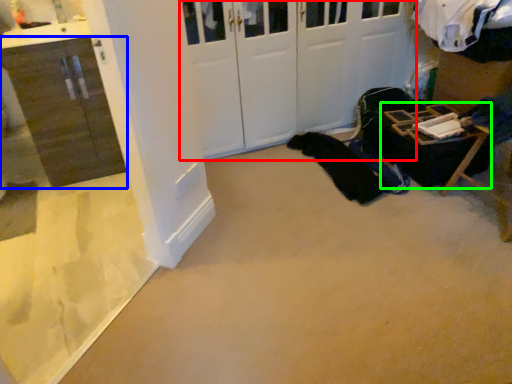
Question: Estimate the real-world distances between objects in this image. Which object is closer to door (highlighted by a red box), cabinetry (highlighted by a blue box) or furniture (highlighted by a green box)?

Choices:
 (A) cabinetry
 (B) furniture

Answer: (B)